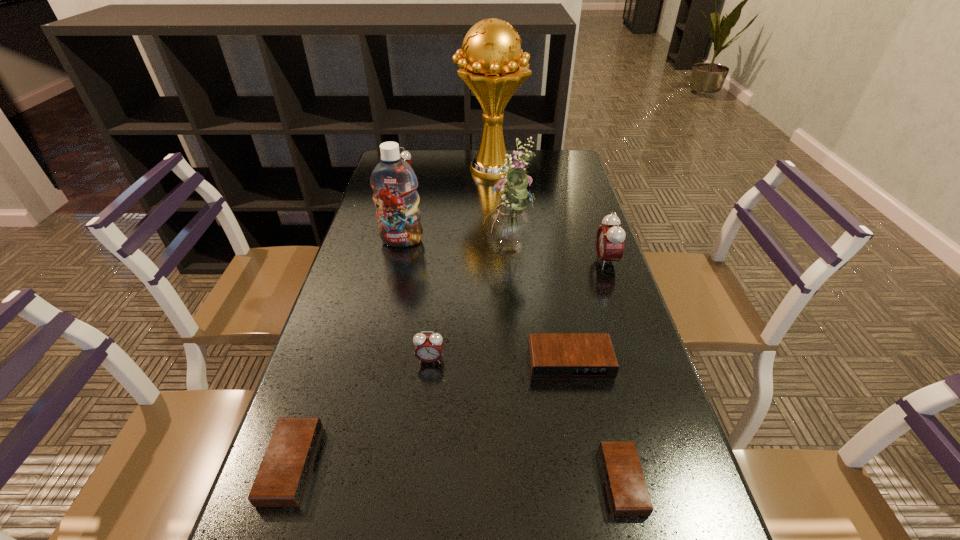
Locate an element on the screen. The height and width of the screenshot is (540, 960). free spot at the right edge of the desktop is located at coordinates (543, 193).

Where is `unoccupied area between the biggest pink alarm clock and the second biggest black alarm clock`? The height and width of the screenshot is (540, 960). unoccupied area between the biggest pink alarm clock and the second biggest black alarm clock is located at coordinates (448, 363).

Locate an element on the screen. vacant area between the shortest alarm clock and the fifth shortest alarm clock is located at coordinates click(x=512, y=330).

You are a GUI agent. You are given a task and a screenshot of the screen. Output one action in this format:
    pyautogui.click(x=<x>, y=<y>)
    Task: Click on the free spot between the bouquet and the third tallest object
    This screenshot has width=960, height=540.
    Given the screenshot: What is the action you would take?
    pyautogui.click(x=455, y=248)

At what (x,y) coordinates should I click in order to perform the action: click on vacant space in between the shortest alarm clock and the leftmost pink alarm clock. Please return your answer as a coordinate pair (x, y). The height and width of the screenshot is (540, 960). Looking at the image, I should click on (512, 330).

Locate an element on the screen. This screenshot has height=540, width=960. empty space between the rightmost object and the trophy_cup is located at coordinates (548, 215).

Find the location of a particular element. free space between the smallest black alarm clock and the second smallest black alarm clock is located at coordinates (457, 473).

Where is `vacant area that lies between the biggest black alarm clock and the seventh shortest object`? vacant area that lies between the biggest black alarm clock and the seventh shortest object is located at coordinates (486, 301).

Locate which object is the fifth closest to the tallest object. Please provide its 2D coordinates. Your answer should be formatted as a tuple, i.e. [(x, y)], where the tuple contains the x and y coordinates of a point satisfying the conditions above.

[(551, 355)]

Locate an element on the screen. object that can be found as the fourth closest to the fifth tallest alarm clock is located at coordinates (508, 226).